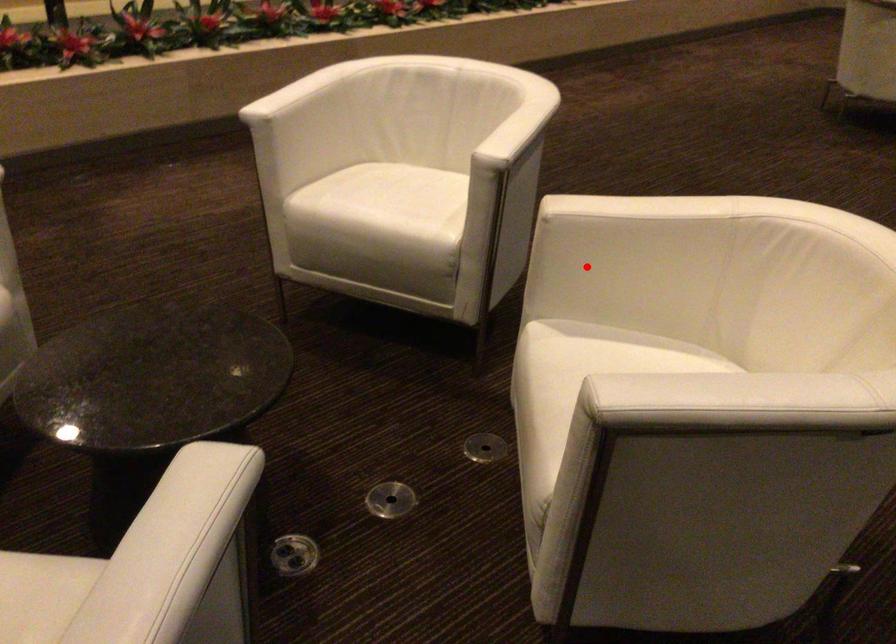
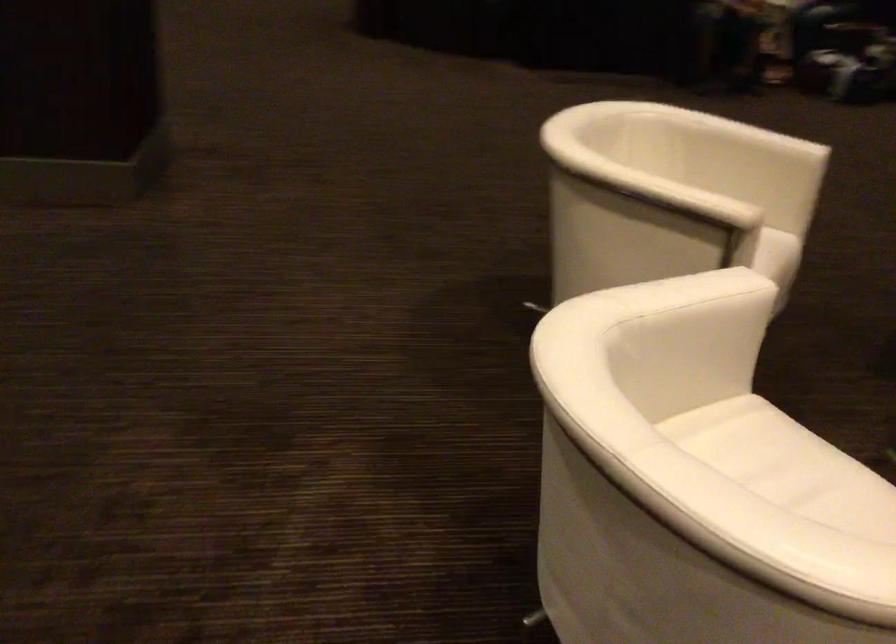
Question: I am providing you with two images of the same scene from different viewpoints. In image1, a red point is highlighted. Considering the same 3D point in image2, which of the following is correct?

Choices:
 (A) It is closer
 (B) It is farther

Answer: (B)